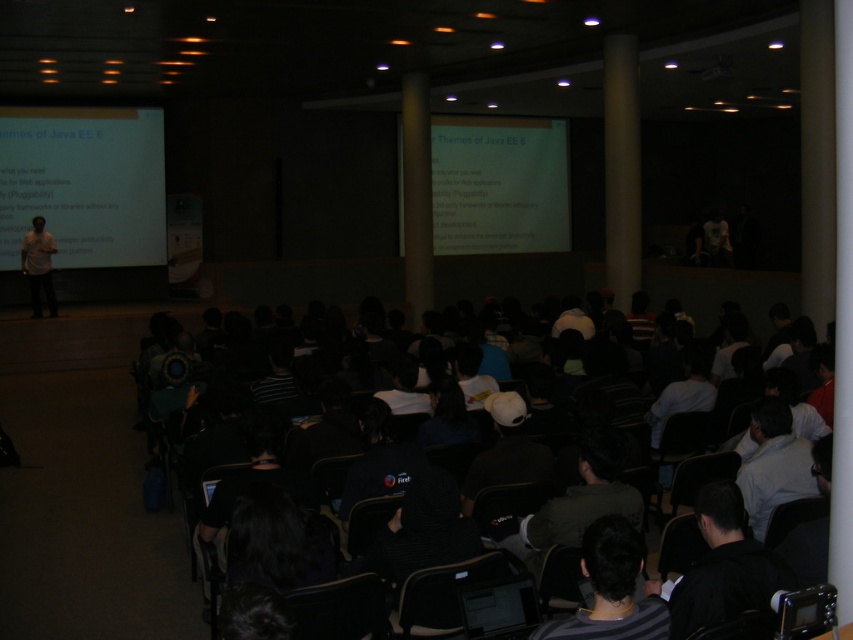
Can you confirm if white matte projection screen at center is wider than white shirt at center?

Yes, white matte projection screen at center is wider than white shirt at center.

From the picture: Between white matte projection screen at center and white shirt at center, which one appears on the right side from the viewer's perspective?

white shirt at center is more to the right.

Between point (444, 192) and point (773, 435), which one is positioned behind?

Point (444, 192)

This screenshot has width=853, height=640. Find the location of `white matte projection screen at center`. white matte projection screen at center is located at coordinates coord(498,184).

Between point (440, 188) and point (640, 563), which one is positioned behind?

Point (440, 188)

Describe the element at coordinates (498, 184) in the screenshot. I see `white matte projection screen at center` at that location.

Locate an element on the screen. The height and width of the screenshot is (640, 853). white matte projection screen at center is located at coordinates (498, 184).

Does black fabric shirt at lower right appear under light brown shirt at left?

Indeed, black fabric shirt at lower right is positioned under light brown shirt at left.

The height and width of the screenshot is (640, 853). What are the coordinates of `black fabric shirt at lower right` in the screenshot? It's located at (723, 566).